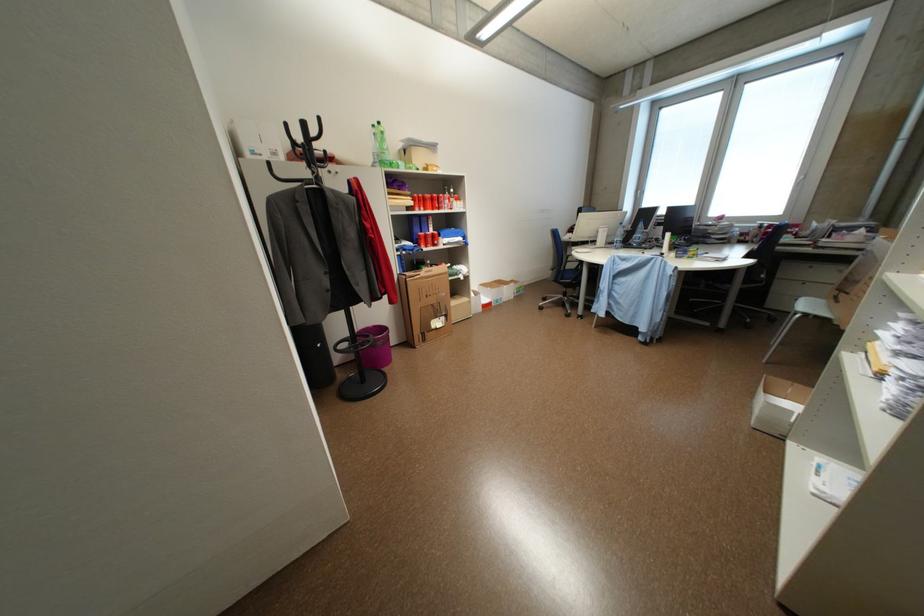
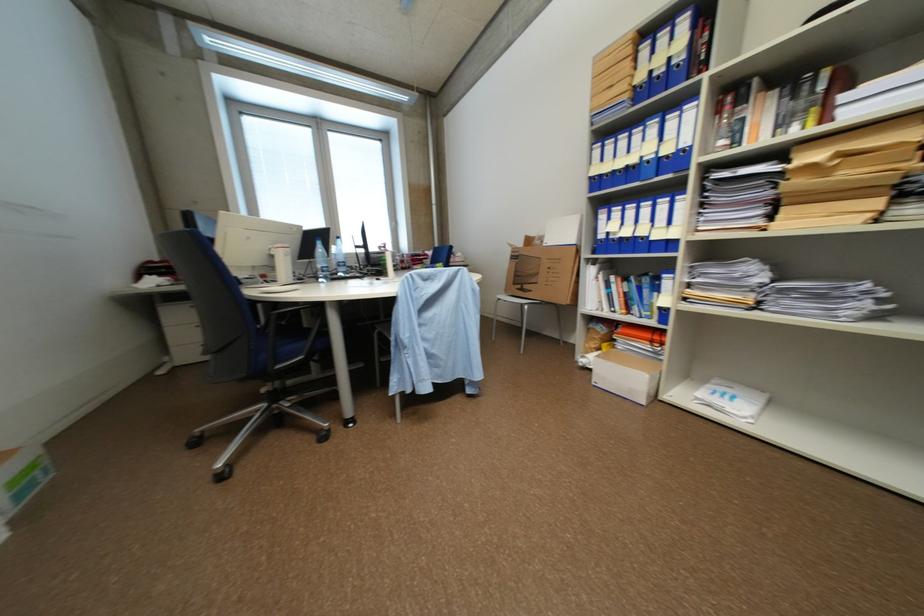
Where in the second image is the point corresponding to the point at 526,293 from the first image?

(28, 496)